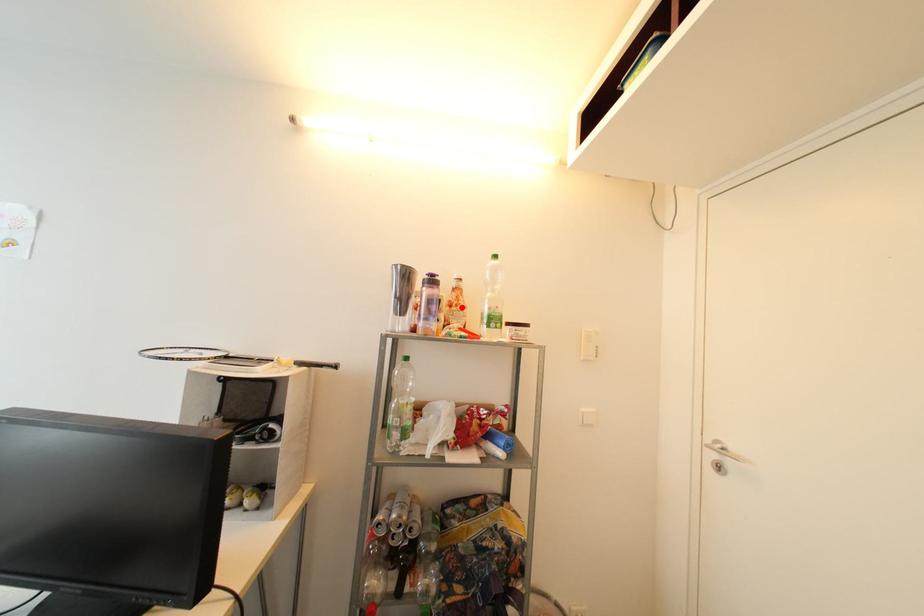
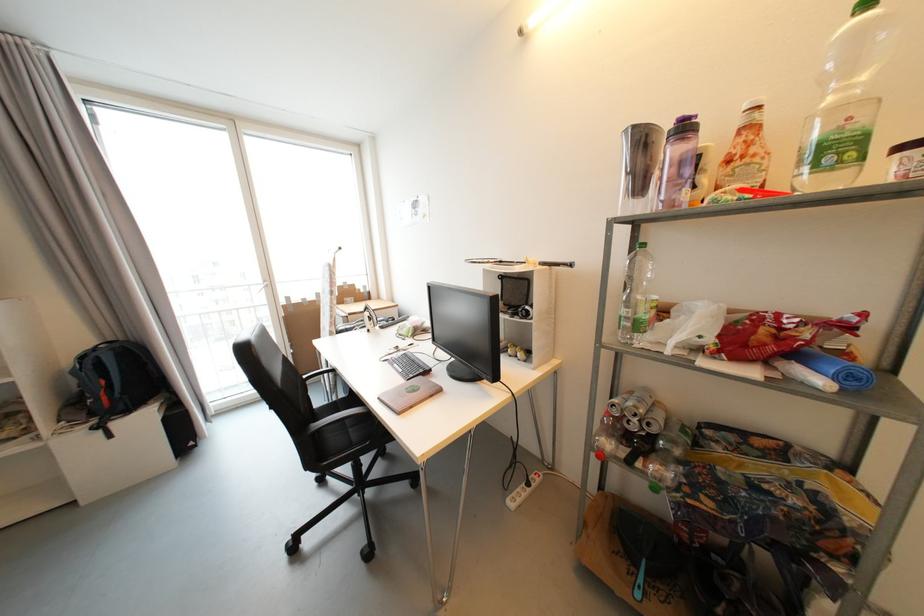
Locate, in the second image, the point that corresponds to the highlighted location in the first image.

(748, 159)